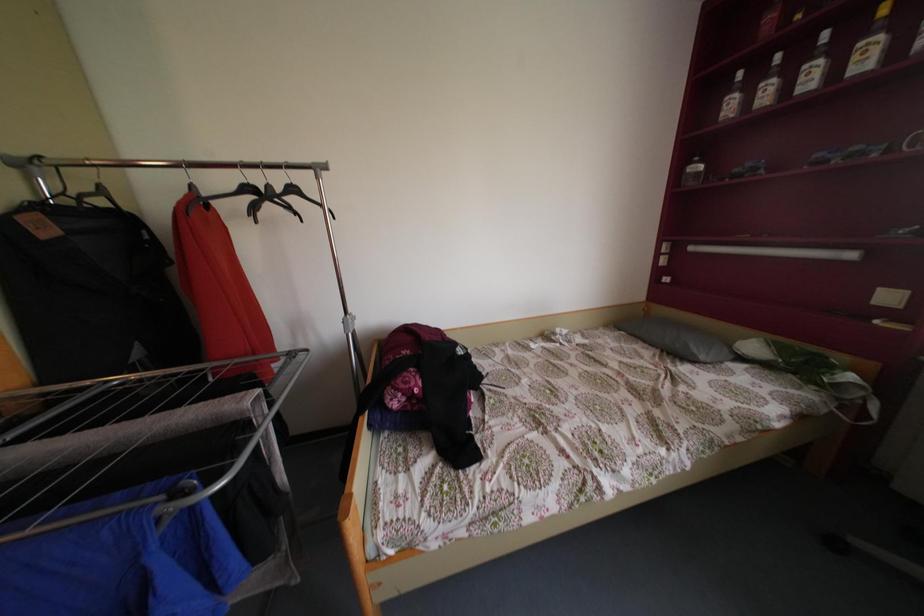
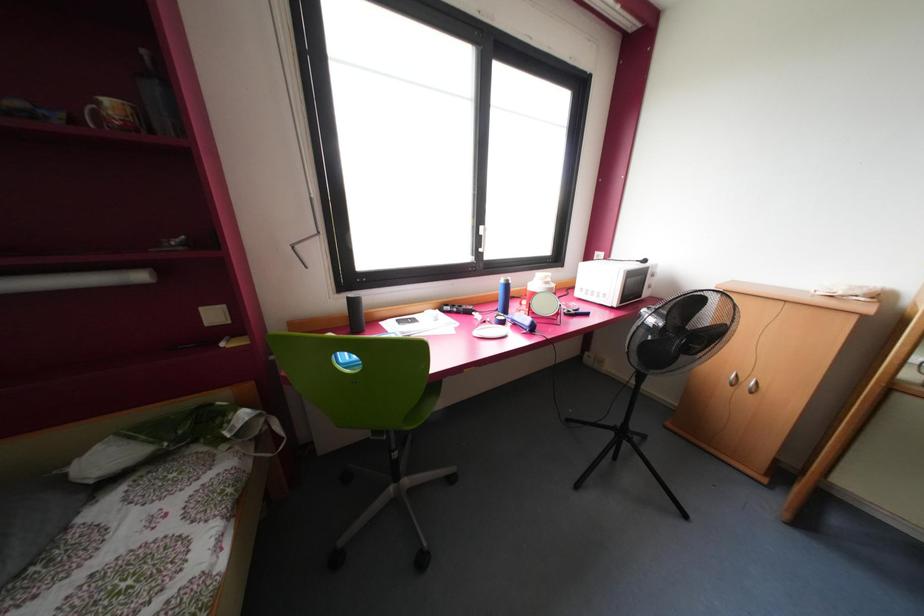
The images are taken continuously from a first-person perspective. In which direction is your viewpoint rotating?

The camera's rotation is toward right-down.